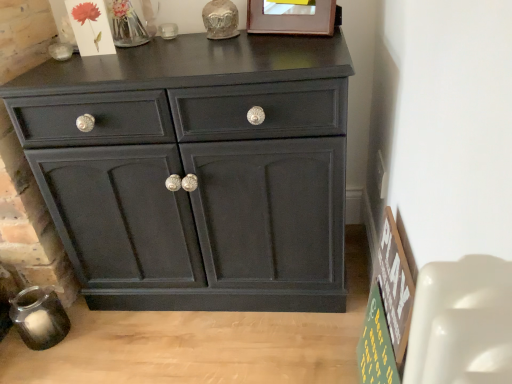
The width and height of the screenshot is (512, 384). Find the location of `free space in front of wooden picture frame at upper center`. free space in front of wooden picture frame at upper center is located at coordinates (294, 47).